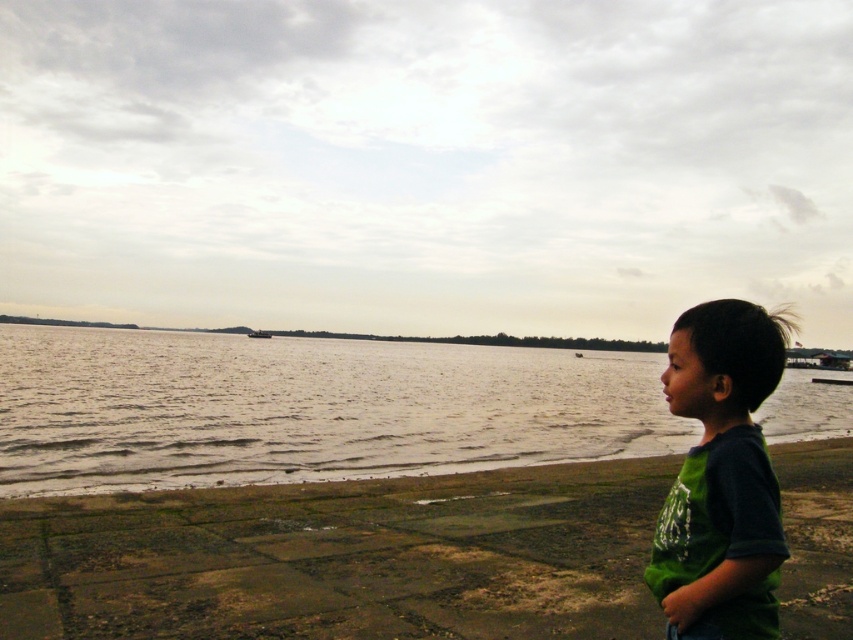
Can you confirm if green cotton shirt at lower right is smaller than dark gray metallic boat at center?

Yes, green cotton shirt at lower right is smaller than dark gray metallic boat at center.

Is green cotton shirt at lower right in front of dark gray metallic boat at center?

Yes, it is in front of dark gray metallic boat at center.

Who is more distant from viewer, (694, 468) or (268, 333)?

Point (268, 333)

Locate an element on the screen. green cotton shirt at lower right is located at coordinates [721, 477].

Which is in front, point (149, 518) or point (250, 333)?

Point (149, 518) is more forward.

Describe the element at coordinates (344, 557) in the screenshot. This screenshot has width=853, height=640. I see `smooth concrete beach at lower right` at that location.

Is point (120, 524) farther from camera compared to point (263, 337)?

No.

At what (x,y) coordinates should I click in order to perform the action: click on smooth concrete beach at lower right. Please return your answer as a coordinate pair (x, y). Image resolution: width=853 pixels, height=640 pixels. Looking at the image, I should click on (x=344, y=557).

Does smooth concrete beach at lower right have a lesser height compared to grayish water at lower left?

Yes.

Can you confirm if smooth concrete beach at lower right is positioned above grayish water at lower left?

Actually, smooth concrete beach at lower right is below grayish water at lower left.

Between point (641, 566) and point (204, 344), which one is positioned in front?

Point (641, 566) is more forward.

The width and height of the screenshot is (853, 640). I want to click on smooth concrete beach at lower right, so click(344, 557).